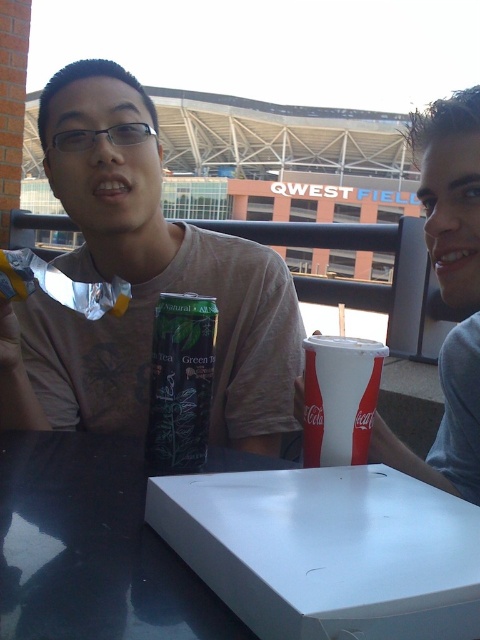
Who is taller, green matte can at center or white glossy table at lower center?

With more height is green matte can at center.

Between green matte can at center and white glossy table at lower center, which one appears on the right side from the viewer's perspective?

From the viewer's perspective, white glossy table at lower center appears more on the right side.

Measure the distance between green matte can at center and camera.

green matte can at center is 23.91 inches from camera.

Locate an element on the screen. This screenshot has width=480, height=640. green matte can at center is located at coordinates (141, 284).

Who is shorter, white glossy table at lower center or white paper cup at center?

Standing shorter between the two is white glossy table at lower center.

Does point (142, 456) lie behind point (316, 435)?

That is True.

You are a GUI agent. You are given a task and a screenshot of the screen. Output one action in this format:
    pyautogui.click(x=<x>, y=<y>)
    Task: Click on the white glossy table at lower center
    The width and height of the screenshot is (480, 640).
    Given the screenshot: What is the action you would take?
    pyautogui.click(x=92, y=548)

Can you confirm if green matte can at center is positioned to the right of green matte tea bag at center?

No, green matte can at center is not to the right of green matte tea bag at center.

Is point (12, 416) behind point (197, 342)?

Yes, it is.

Image resolution: width=480 pixels, height=640 pixels. I want to click on green matte can at center, so click(x=141, y=284).